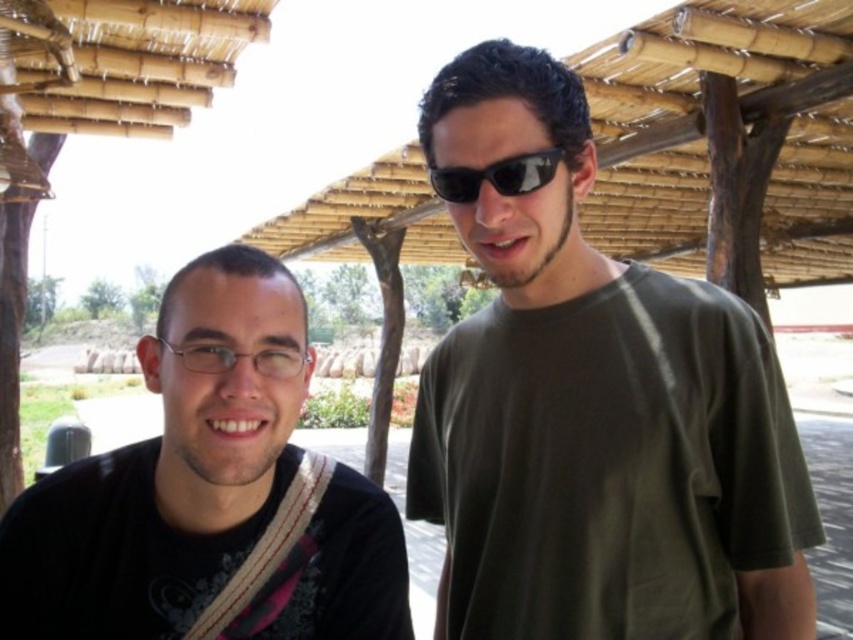
You are a photographer positioned in front of the bamboo structure. You notice the black matte shirt at left and the sunglasses at center in your frame. Which object should you focus on if you want to capture the taller one in your shot?

The black matte shirt at left is taller than the sunglasses at center, so you should focus on the black matte shirt at left to capture the taller one.